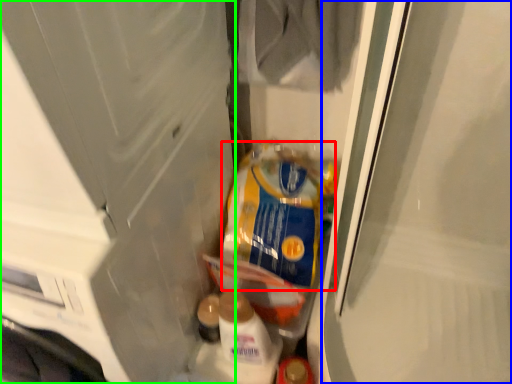
Question: Based on their relative distances, which object is nearer to product (highlighted by a red box)? Choose from screen door (highlighted by a blue box) and screen door (highlighted by a green box).

Choices:
 (A) screen door
 (B) screen door

Answer: (A)